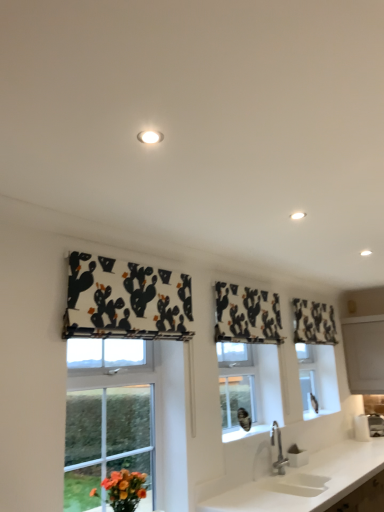
Locate an element on the screen. black printed fabric at center, positioned as the 2th curtain in right-to-left order is located at coordinates (247, 315).

The height and width of the screenshot is (512, 384). Describe the element at coordinates (313, 322) in the screenshot. I see `black printed fabric at upper center, acting as the third curtain starting from the left` at that location.

Locate an element on the screen. white matte countertop at lower center is located at coordinates (307, 481).

Locate an element on the screen. black printed fabric at center, which appears as the second curtain when viewed from the front is located at coordinates (247, 315).

Is white fabric with black cactus print at left, acting as the 1th curtain starting from the left, not close to black printed fabric at center, which appears as the second curtain when viewed from the front?

No, white fabric with black cactus print at left, acting as the 1th curtain starting from the left, is not far away from black printed fabric at center, which appears as the second curtain when viewed from the front.

From the image's perspective, is white fabric with black cactus print at left, arranged as the third curtain when viewed from the right, above or below black printed fabric at center, which is counted as the 2th curtain, starting from the back?

Based on their image positions, white fabric with black cactus print at left, arranged as the third curtain when viewed from the right, is located above black printed fabric at center, which is counted as the 2th curtain, starting from the back.

Consider the image. Measure the distance between white fabric with black cactus print at left, acting as the 1th curtain starting from the left, and black printed fabric at center, positioned as the 2th curtain in right-to-left order.

white fabric with black cactus print at left, acting as the 1th curtain starting from the left, and black printed fabric at center, positioned as the 2th curtain in right-to-left order, are 32.72 inches apart.

What's the angular difference between white fabric with black cactus print at left, the 1th curtain from the front, and black printed fabric at center, which appears as the second curtain when viewed from the front,'s facing directions?

The facing directions of white fabric with black cactus print at left, the 1th curtain from the front, and black printed fabric at center, which appears as the second curtain when viewed from the front, are 0.000942 degrees apart.

Consider the image. From a real-world perspective, is white matte countertop at lower center positioned above or below black printed fabric at upper center, acting as the 1th curtain starting from the back?

Clearly, from a real-world perspective, white matte countertop at lower center is below black printed fabric at upper center, acting as the 1th curtain starting from the back.

Considering the sizes of objects white matte countertop at lower center and black printed fabric at upper center, arranged as the 3th curtain when viewed from the front, in the image provided, who is taller, white matte countertop at lower center or black printed fabric at upper center, arranged as the 3th curtain when viewed from the front,?

white matte countertop at lower center.

Which is in front, point (269, 477) or point (324, 324)?

The point (269, 477) is more forward.

Is white matte countertop at lower center closer to the viewer compared to black printed fabric at upper center, acting as the third curtain starting from the left?

Yes, white matte countertop at lower center is in front of black printed fabric at upper center, acting as the third curtain starting from the left.

Can you confirm if black printed fabric at center, which is counted as the 2th curtain, starting from the back, is taller than white matte countertop at lower center?

No, black printed fabric at center, which is counted as the 2th curtain, starting from the back, is not taller than white matte countertop at lower center.

What's the angular difference between black printed fabric at center, arranged as the second curtain when viewed from the left, and white matte countertop at lower center's facing directions?

They differ by 0.827 degrees in their facing directions.

From a real-world perspective, is black printed fabric at center, positioned as the 2th curtain in right-to-left order, physically located above or below white matte countertop at lower center?

black printed fabric at center, positioned as the 2th curtain in right-to-left order, is above white matte countertop at lower center.

In the image, is black printed fabric at center, which appears as the second curtain when viewed from the front, positioned in front of or behind white matte countertop at lower center?

black printed fabric at center, which appears as the second curtain when viewed from the front, is positioned farther from the viewer than white matte countertop at lower center.

In terms of height, does black printed fabric at upper center, acting as the 1th curtain starting from the back, look taller or shorter compared to white glossy light fixture at upper center?

black printed fabric at upper center, acting as the 1th curtain starting from the back, is taller than white glossy light fixture at upper center.

Between black printed fabric at upper center, acting as the third curtain starting from the left, and white glossy light fixture at upper center, which one has smaller size?

white glossy light fixture at upper center.

Which of these two, black printed fabric at upper center, acting as the third curtain starting from the left, or white glossy light fixture at upper center, is wider?

white glossy light fixture at upper center is wider.

Is black printed fabric at upper center, acting as the third curtain starting from the left, oriented away from white glossy light fixture at upper center?

black printed fabric at upper center, acting as the third curtain starting from the left, does not have its back to white glossy light fixture at upper center.

From the image's perspective, is white fabric with black cactus print at left, the 1th curtain from the front, beneath white matte countertop at lower center?

No.

Could you tell me if white fabric with black cactus print at left, the third curtain when ordered from back to front, is turned towards white matte countertop at lower center?

No, white fabric with black cactus print at left, the third curtain when ordered from back to front, is not facing towards white matte countertop at lower center.

Does white fabric with black cactus print at left, the third curtain when ordered from back to front, have a lesser height compared to white matte countertop at lower center?

Indeed, white fabric with black cactus print at left, the third curtain when ordered from back to front, has a lesser height compared to white matte countertop at lower center.

Can you confirm if white fabric with black cactus print at left, the third curtain when ordered from back to front, is positioned to the left of white matte countertop at lower center?

Yes, white fabric with black cactus print at left, the third curtain when ordered from back to front, is to the left of white matte countertop at lower center.

Considering the sizes of objects white fabric with black cactus print at left, the 1th curtain from the front, and black printed fabric at upper center, acting as the 1th curtain starting from the back, in the image provided, who is taller, white fabric with black cactus print at left, the 1th curtain from the front, or black printed fabric at upper center, acting as the 1th curtain starting from the back,?

With more height is black printed fabric at upper center, acting as the 1th curtain starting from the back.

From the image's perspective, is white fabric with black cactus print at left, the 1th curtain from the front, located above or below black printed fabric at upper center, acting as the third curtain starting from the left?

white fabric with black cactus print at left, the 1th curtain from the front, is above black printed fabric at upper center, acting as the third curtain starting from the left.

Considering the sizes of objects white fabric with black cactus print at left, the third curtain when ordered from back to front, and black printed fabric at upper center, acting as the third curtain starting from the left, in the image provided, who is wider, white fabric with black cactus print at left, the third curtain when ordered from back to front, or black printed fabric at upper center, acting as the third curtain starting from the left,?

white fabric with black cactus print at left, the third curtain when ordered from back to front, is wider.

Based on the photo, from a real-world perspective, which object stands above the other?

white glossy light fixture at upper center is physically above.

Which object is closer to the camera taking this photo, black printed fabric at center, which appears as the second curtain when viewed from the front, or white glossy light fixture at upper center?

white glossy light fixture at upper center is in front.

Is black printed fabric at center, which appears as the second curtain when viewed from the front, oriented towards white glossy light fixture at upper center?

Yes, black printed fabric at center, which appears as the second curtain when viewed from the front, is oriented towards white glossy light fixture at upper center.

You are a GUI agent. You are given a task and a screenshot of the screen. Output one action in this format:
    pyautogui.click(x=<x>, y=<y>)
    Task: Click on the curtain in front of the black printed fabric at center, arranged as the second curtain when viewed from the left
    
    Given the screenshot: What is the action you would take?
    pyautogui.click(x=126, y=300)

From the image's perspective, starting from the white matte countertop at lower center, which curtain is the 1st one above? Please provide its 2D coordinates.

[(313, 322)]

Considering their positions, is white glossy light fixture at upper center positioned further to black printed fabric at upper center, the 1th curtain positioned from the right, than white fabric with black cactus print at left, the third curtain when ordered from back to front?

white glossy light fixture at upper center is positioned further to the anchor black printed fabric at upper center, the 1th curtain positioned from the right.

From the image, which object appears to be farther from black printed fabric at upper center, acting as the third curtain starting from the left, white matte countertop at lower center or white fabric with black cactus print at left, the 1th curtain from the front?

white fabric with black cactus print at left, the 1th curtain from the front, is further to black printed fabric at upper center, acting as the third curtain starting from the left.

From the image, which object appears to be nearer to white glossy light fixture at upper center, black printed fabric at upper center, the 1th curtain positioned from the right, or white matte countertop at lower center?

white matte countertop at lower center is positioned closer to the anchor white glossy light fixture at upper center.

Which object lies nearer to the anchor point white matte countertop at lower center, black printed fabric at upper center, the 1th curtain positioned from the right, or black printed fabric at center, arranged as the second curtain when viewed from the left?

The object closer to white matte countertop at lower center is black printed fabric at center, arranged as the second curtain when viewed from the left.

Estimate the real-world distances between objects in this image. Which object is further from white glossy light fixture at upper center, white fabric with black cactus print at left, the third curtain when ordered from back to front, or black printed fabric at center, which appears as the second curtain when viewed from the front?

The object further to white glossy light fixture at upper center is black printed fabric at center, which appears as the second curtain when viewed from the front.

Estimate the real-world distances between objects in this image. Which object is closer to white glossy light fixture at upper center, white fabric with black cactus print at left, the third curtain when ordered from back to front, or white matte countertop at lower center?

Based on the image, white fabric with black cactus print at left, the third curtain when ordered from back to front, appears to be nearer to white glossy light fixture at upper center.

Looking at the image, which one is located closer to white matte countertop at lower center, black printed fabric at upper center, acting as the third curtain starting from the left, or white fabric with black cactus print at left, arranged as the third curtain when viewed from the right?

black printed fabric at upper center, acting as the third curtain starting from the left, is closer to white matte countertop at lower center.

Based on their spatial positions, is black printed fabric at upper center, the 1th curtain positioned from the right, or white matte countertop at lower center further from white fabric with black cactus print at left, arranged as the third curtain when viewed from the right?

black printed fabric at upper center, the 1th curtain positioned from the right, lies further to white fabric with black cactus print at left, arranged as the third curtain when viewed from the right, than the other object.

I want to click on curtain between white fabric with black cactus print at left, acting as the 1th curtain starting from the left, and black printed fabric at upper center, acting as the third curtain starting from the left, from front to back, so click(247, 315).

Find the location of `curtain between white fabric with black cactus print at left, the third curtain when ordered from back to front, and white glossy light fixture at upper center from left to right`. curtain between white fabric with black cactus print at left, the third curtain when ordered from back to front, and white glossy light fixture at upper center from left to right is located at coordinates (247, 315).

Locate an element on the screen. This screenshot has height=512, width=384. lighting positioned between white fabric with black cactus print at left, the 1th curtain from the front, and black printed fabric at upper center, acting as the 1th curtain starting from the back, from near to far is located at coordinates (297, 215).

Find the location of a particular element. This screenshot has width=384, height=512. curtain located between white glossy light fixture at upper center and black printed fabric at upper center, the 1th curtain positioned from the right, in the depth direction is located at coordinates (247, 315).